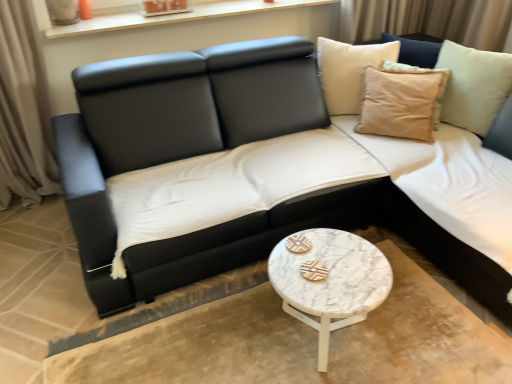
Question: Does black leather couch at center have a greater height compared to beige cotton cushion at upper right?

Choices:
 (A) yes
 (B) no

Answer: (A)

Question: Is black leather couch at center completely or partially outside of beige cotton cushion at upper right?

Choices:
 (A) no
 (B) yes

Answer: (B)

Question: Could you tell me if black leather couch at center is facing beige cotton cushion at upper right?

Choices:
 (A) yes
 (B) no

Answer: (B)

Question: Is beige cotton cushion at upper right a part of black leather couch at center?

Choices:
 (A) yes
 (B) no

Answer: (B)

Question: Considering the relative sizes of black leather couch at center and beige cotton cushion at upper right in the image provided, is black leather couch at center smaller than beige cotton cushion at upper right?

Choices:
 (A) yes
 (B) no

Answer: (B)

Question: Is black leather couch at center inside or outside of white marble coffee table at center?

Choices:
 (A) inside
 (B) outside

Answer: (B)

Question: Based on their positions, is black leather couch at center located to the left or right of white marble coffee table at center?

Choices:
 (A) right
 (B) left

Answer: (B)

Question: Is black leather couch at center in front of or behind white marble coffee table at center in the image?

Choices:
 (A) behind
 (B) front

Answer: (A)

Question: From the image's perspective, is black leather couch at center positioned above or below white marble coffee table at center?

Choices:
 (A) above
 (B) below

Answer: (A)

Question: Is beige cotton cushion at upper right inside or outside of white marble coffee table at center?

Choices:
 (A) inside
 (B) outside

Answer: (B)

Question: From the image's perspective, is beige cotton cushion at upper right located above or below white marble coffee table at center?

Choices:
 (A) below
 (B) above

Answer: (B)

Question: Is beige cotton cushion at upper right wider or thinner than white marble coffee table at center?

Choices:
 (A) wide
 (B) thin

Answer: (B)

Question: Would you say beige cotton cushion at upper right is to the left or to the right of white marble coffee table at center in the picture?

Choices:
 (A) right
 (B) left

Answer: (A)

Question: From the image's perspective, is black leather couch at center positioned above or below beige cotton cushion at upper right?

Choices:
 (A) below
 (B) above

Answer: (A)

Question: Is black leather couch at center inside or outside of beige cotton cushion at upper right?

Choices:
 (A) inside
 (B) outside

Answer: (B)